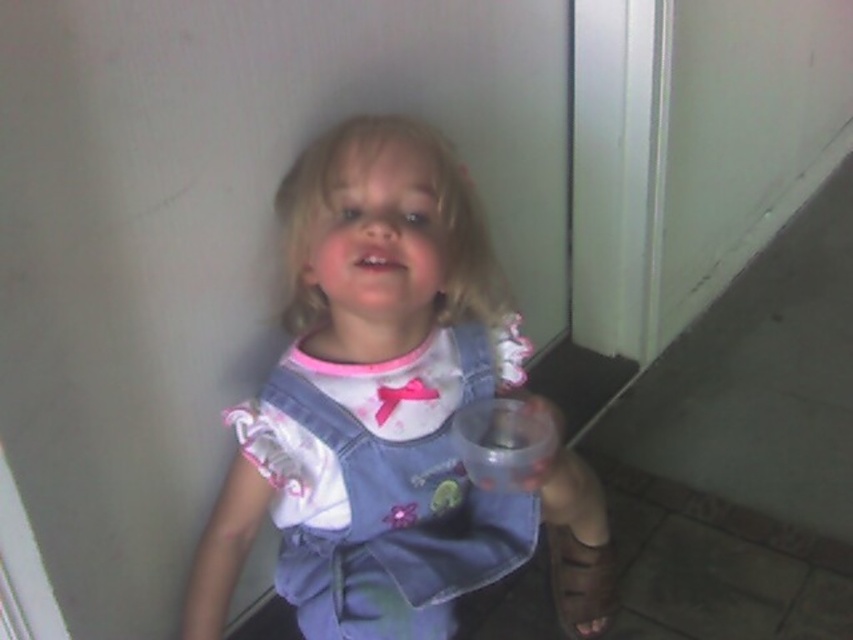
Question: Which point is closer to the camera taking this photo?

Choices:
 (A) click(341, 483)
 (B) click(589, 522)

Answer: (A)

Question: Can you confirm if denim overalls at center is positioned to the left of denim dress at center?

Choices:
 (A) yes
 (B) no

Answer: (B)

Question: Among these points, which one is nearest to the camera?

Choices:
 (A) (396, 636)
 (B) (422, 342)

Answer: (A)

Question: Is denim overalls at center to the left of denim dress at center from the viewer's perspective?

Choices:
 (A) no
 (B) yes

Answer: (A)

Question: Among these points, which one is nearest to the camera?

Choices:
 (A) (494, 548)
 (B) (223, 563)

Answer: (B)

Question: Does denim overalls at center have a lesser width compared to denim dress at center?

Choices:
 (A) no
 (B) yes

Answer: (A)